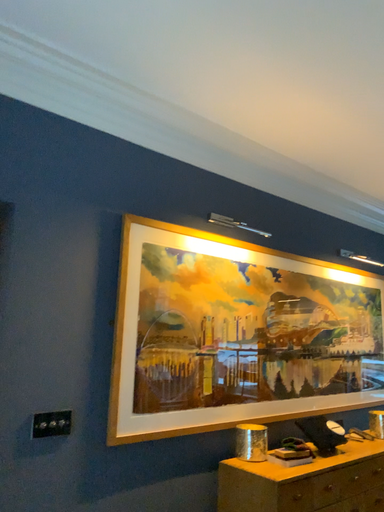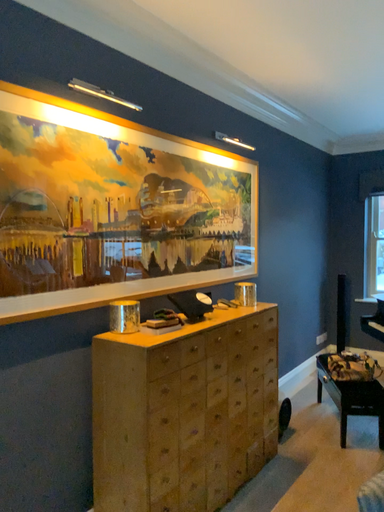
Question: How did the camera likely rotate when shooting the video?

Choices:
 (A) rotated upward
 (B) rotated downward

Answer: (B)